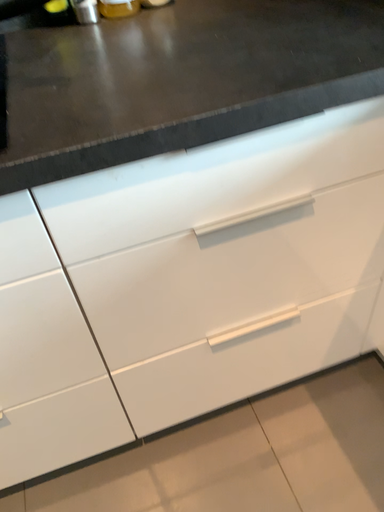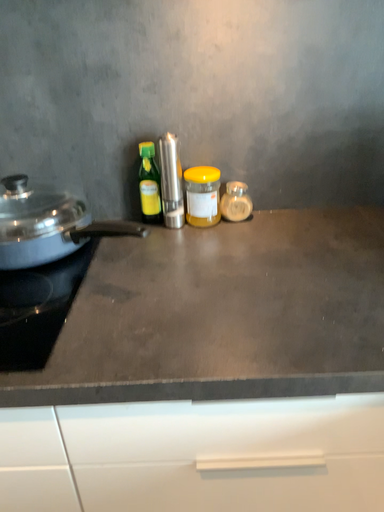
Question: Which way did the camera rotate in the video?

Choices:
 (A) rotated downward
 (B) rotated upward

Answer: (B)